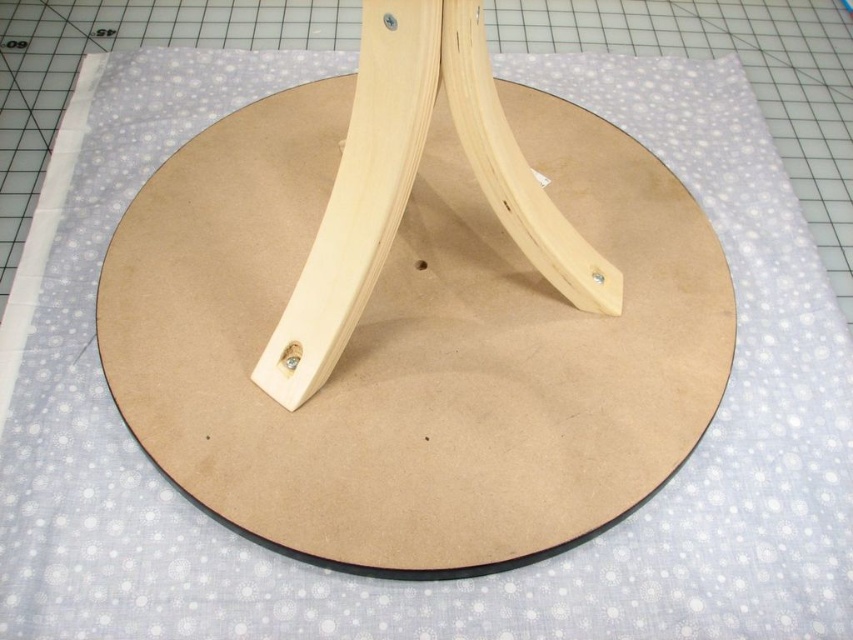
Question: Does natural wood round base at center have a greater width compared to natural wood tripod at center?

Choices:
 (A) no
 (B) yes

Answer: (B)

Question: Which point appears farthest from the camera in this image?

Choices:
 (A) (413, 32)
 (B) (403, 276)

Answer: (B)

Question: Is natural wood round base at center to the right of natural wood tripod at center from the viewer's perspective?

Choices:
 (A) no
 (B) yes

Answer: (A)

Question: Is natural wood round base at center further to camera compared to natural wood tripod at center?

Choices:
 (A) no
 (B) yes

Answer: (B)